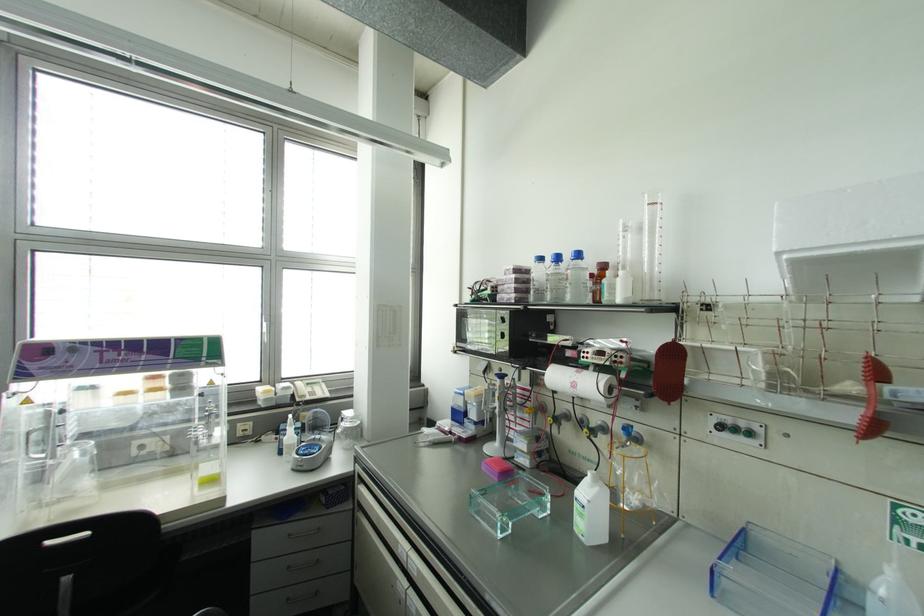
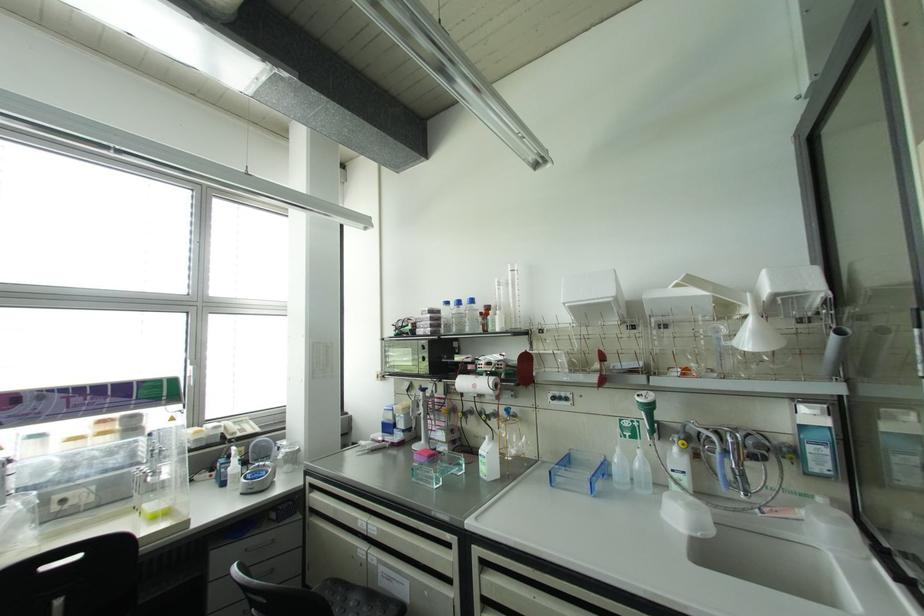
Find the pixel in the second image that matches [639,228] in the first image.

(506, 284)